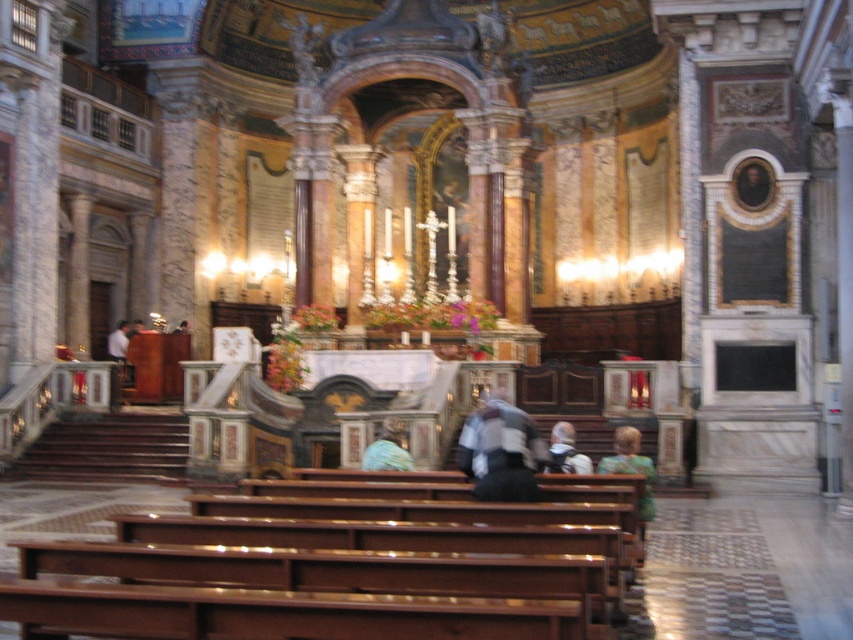
Consider the image. Which is above, light blue fabric at center or light brown leather jacket at lower center?

Positioned higher is light brown leather jacket at lower center.

Where is `light blue fabric at center`? light blue fabric at center is located at coordinates (387, 449).

Between green textured sweater at lower center and white fabric shirt at left, which one is positioned lower?

green textured sweater at lower center

This screenshot has height=640, width=853. What do you see at coordinates (631, 467) in the screenshot?
I see `green textured sweater at lower center` at bounding box center [631, 467].

I want to click on green textured sweater at lower center, so click(x=631, y=467).

Does green textured sweater at lower center appear over light blue fabric at center?

No.

Is green textured sweater at lower center positioned before light blue fabric at center?

Yes, green textured sweater at lower center is closer to the viewer.

Is point (596, 468) closer to viewer compared to point (392, 442)?

No.

Locate an element on the screen. green textured sweater at lower center is located at coordinates (631, 467).